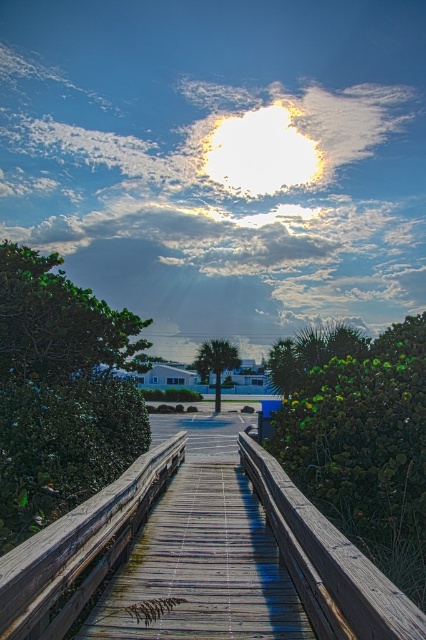
You are a maintenance worker tasked with checking the spacing between the weathered wood boardwalk at center and the weathered wood rail at center. According to safety regulations, the minimum required distance between them must be at least 4 meters. Can you confirm if the current spacing meets this requirement?

The distance between the weathered wood boardwalk at center and the weathered wood rail at center is 4.67 meters, which exceeds the minimum requirement of 4 meters. Therefore, the spacing meets the safety regulations.

You are standing at the starting point of the boardwalk and want to reach the parking area. According to the coordinates provided, where exactly is the weathered wood boardwalk at center located?

The weathered wood boardwalk at center is located at point coordinates of [204,552].

You are standing at the point labeled as point (204,552) in the image. What object are you standing on?

You are standing on the weathered wood boardwalk at center located at point (204,552).